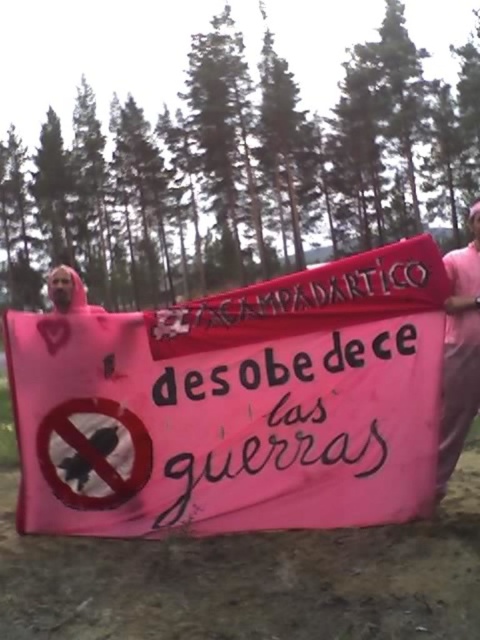
Does pink fabric banner at center have a smaller size compared to pink fabric at center?

Incorrect, pink fabric banner at center is not smaller in size than pink fabric at center.

Can you confirm if pink fabric banner at center is positioned to the right of pink fabric at center?

Incorrect, pink fabric banner at center is not on the right side of pink fabric at center.

Is point (240, 371) positioned behind point (458, 440)?

That is False.

Locate an element on the screen. The image size is (480, 640). pink fabric banner at center is located at coordinates (237, 404).